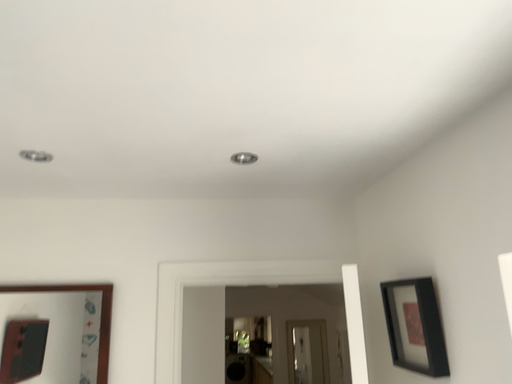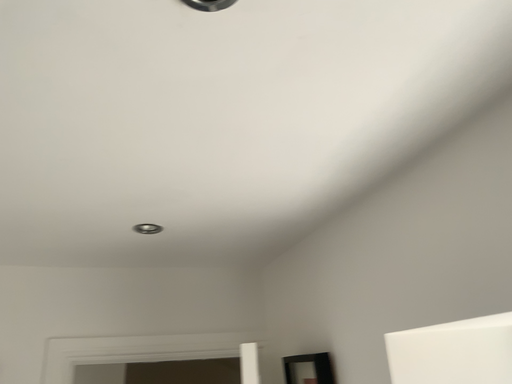
Question: Which way did the camera rotate in the video?

Choices:
 (A) rotated upward
 (B) rotated downward

Answer: (A)